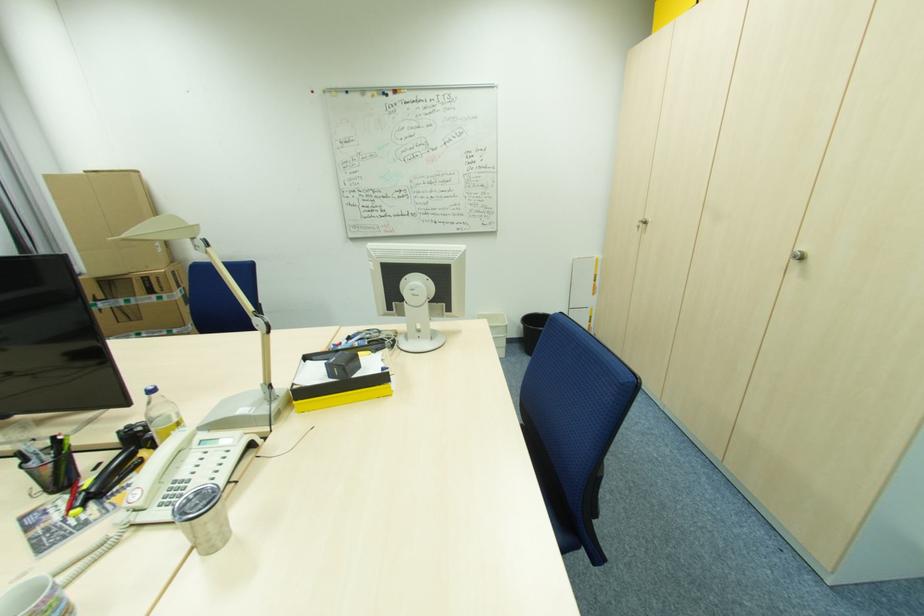
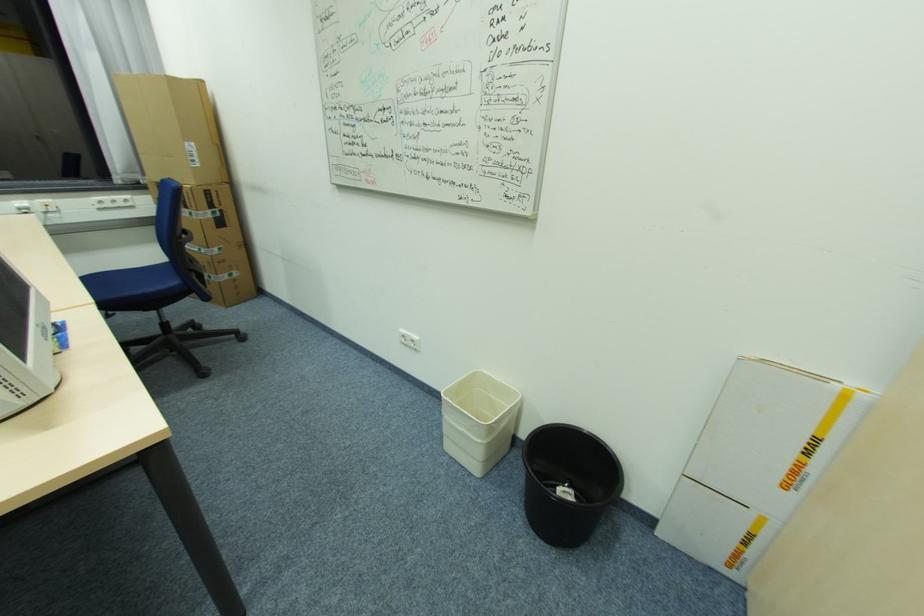
In the second image, find the point that corresponds to pixel 598 288 in the first image.

(797, 472)